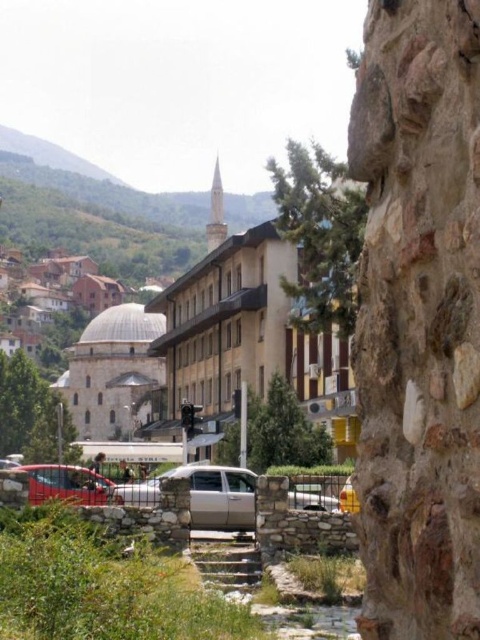
You are a tourist visiting the town and want to take a photo that includes both the beige stone mosque at center and the metallic silver car at lower left. Which object should you position closer to the camera to ensure both are visible in the frame?

To ensure both the beige stone mosque at center and the metallic silver car at lower left are visible in the frame, position the metallic silver car at lower left closer to the camera since the beige stone mosque at center is larger in size and will take up more space in the photo.

You are a photographer planning to take a photo of the town scene. You want to include both the silver metallic sedan at center and the metallic silver car at lower left in the frame. Which of the two vehicles should you focus on to ensure it appears larger in the final photo?

The silver metallic sedan at center should be focused on because it is bigger than the metallic silver car at lower left, so it will naturally appear larger in the photo.

You are a tourist standing at the edge of the town square. You want to take a photo of the silver metallic sedan at center without the beige stone mosque at center blocking the view. Is it possible to do so from your current position?

The silver metallic sedan at center is behind the beige stone mosque at center, so it is blocked from view. You would need to move to a position where the mosque is not between you and the sedan to take the photo.